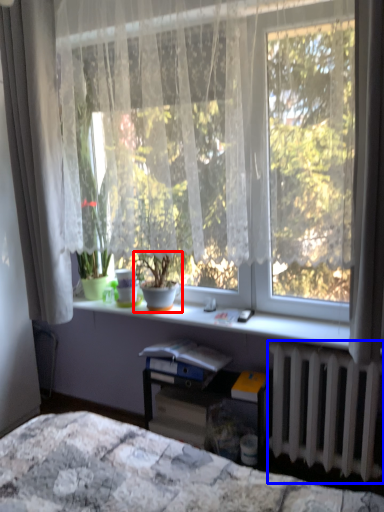
Question: Which of the following is the farthest to the observer, houseplant (highlighted by a red box) or radiator (highlighted by a blue box)?

Choices:
 (A) houseplant
 (B) radiator

Answer: (A)